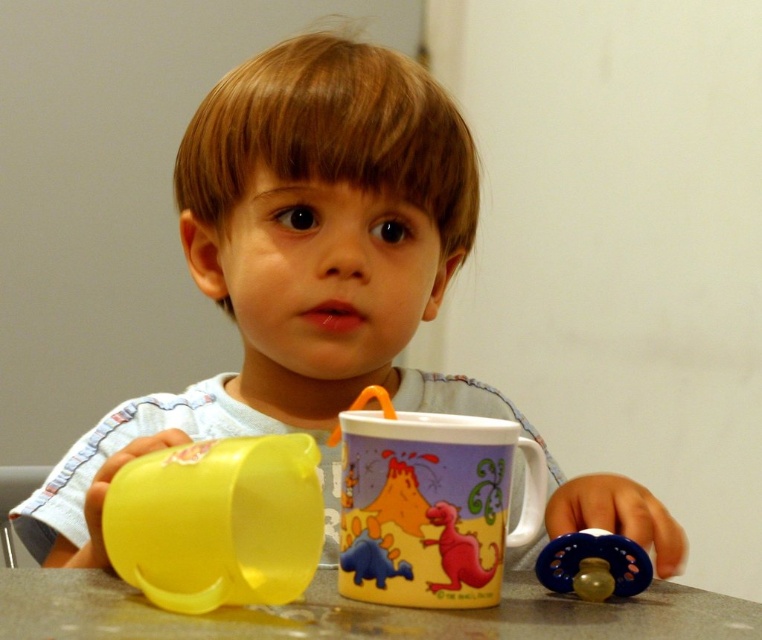
Question: Is smooth granite table at center to the right of yellow plastic cup at left from the viewer's perspective?

Choices:
 (A) yes
 (B) no

Answer: (A)

Question: Which is nearer to the smooth granite table at center?

Choices:
 (A) rubberized plastic dinosaur at center
 (B) matte ceramic mug at center
 (C) yellow plastic cup at left

Answer: (B)

Question: Among these points, which one is farthest from the camera?

Choices:
 (A) (359, 417)
 (B) (293, 630)
 (C) (184, 540)

Answer: (A)

Question: Is matte ceramic mug at center thinner than smooth granite table at center?

Choices:
 (A) no
 (B) yes

Answer: (B)

Question: Which of the following is the closest to the observer?

Choices:
 (A) click(x=279, y=536)
 (B) click(x=642, y=556)
 (C) click(x=428, y=518)

Answer: (C)

Question: Can you confirm if yellow plastic cup at left is positioned below blue rubber pacifier at lower right?

Choices:
 (A) yes
 (B) no

Answer: (B)